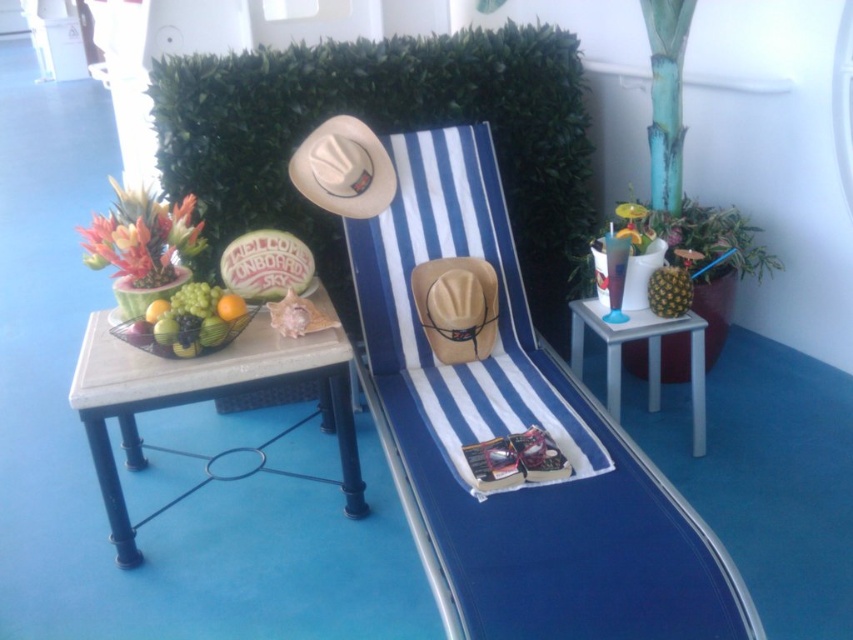
Question: Which point is farther to the camera?

Choices:
 (A) (381, 205)
 (B) (637, 317)

Answer: (A)

Question: Does tan leather cowboy hat at center appear on the left side of orange matte at center?

Choices:
 (A) yes
 (B) no

Answer: (B)

Question: Which point appears farthest from the camera in this image?

Choices:
 (A) (218, 310)
 (B) (608, 365)

Answer: (B)

Question: Can you confirm if green leafy hedge at upper center is positioned above brown straw cowboy hat at center?

Choices:
 (A) yes
 (B) no

Answer: (B)

Question: Considering the real-world distances, which object is closest to the green matte grapes at left?

Choices:
 (A) tan leather cowboy hat at center
 (B) white marble table at center
 (C) white plastic side table at right
 (D) brown straw cowboy hat at center

Answer: (B)

Question: Can you confirm if blue striped beach chair at center is bigger than green leafy hedge at upper center?

Choices:
 (A) yes
 (B) no

Answer: (B)